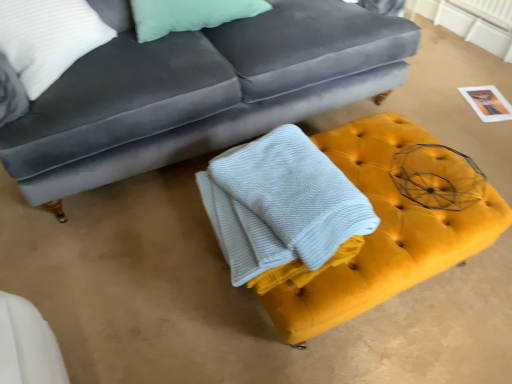
Question: Considering the positions of point (112, 158) and point (357, 231), is point (112, 158) closer or farther from the camera than point (357, 231)?

Choices:
 (A) closer
 (B) farther

Answer: (B)

Question: Is velvet gray couch at upper center bigger or smaller than white textured bath towel at center?

Choices:
 (A) big
 (B) small

Answer: (A)

Question: Considering the real-world distances, which object is farthest from the yellow velvet ottoman at center?

Choices:
 (A) white textured bath towel at center
 (B) velvet gray couch at upper center
 (C) white textured pillow at upper left

Answer: (C)

Question: Which object is positioned closest to the velvet gray couch at upper center?

Choices:
 (A) white textured pillow at upper left
 (B) yellow velvet ottoman at center
 (C) white textured bath towel at center

Answer: (A)